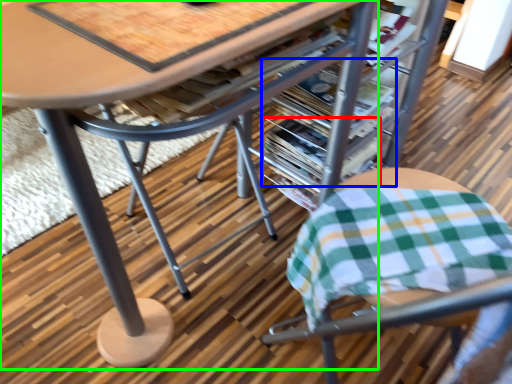
Question: Which object is the farthest from magazine (highlighted by a red box)? Choose among these: magazine (highlighted by a blue box) or table (highlighted by a green box).

Choices:
 (A) magazine
 (B) table

Answer: (B)